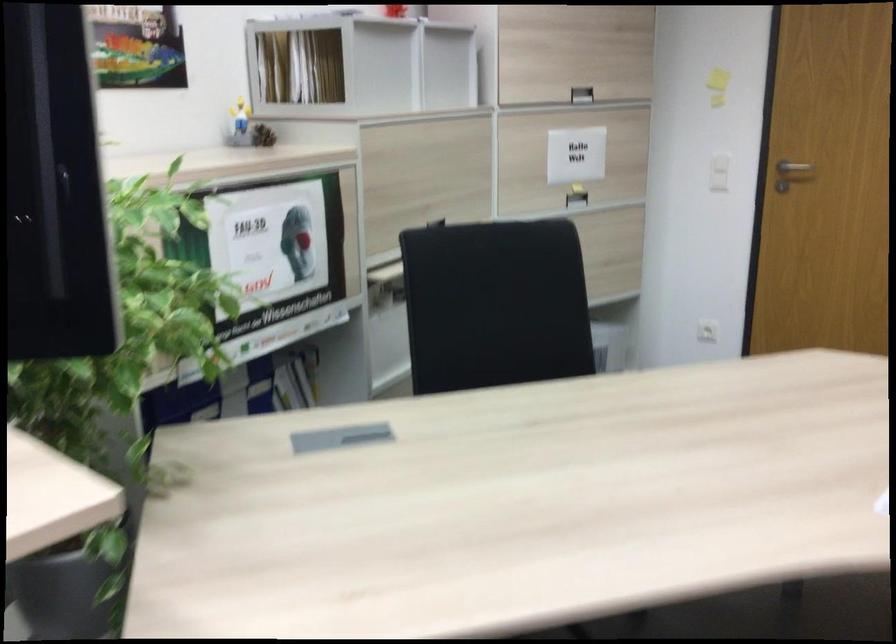
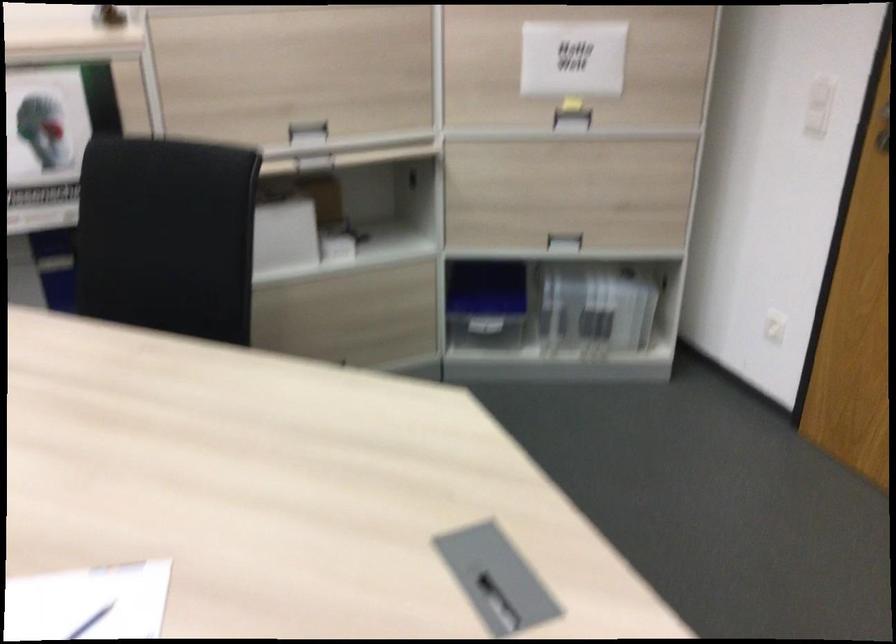
In the second image, find the point that corresponds to pixel 581 196 in the first image.

(572, 120)